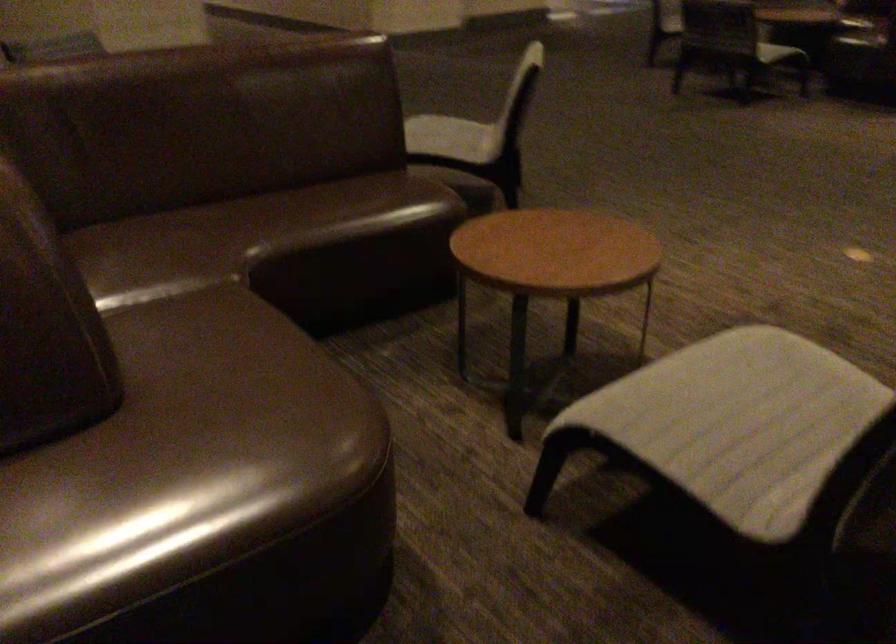
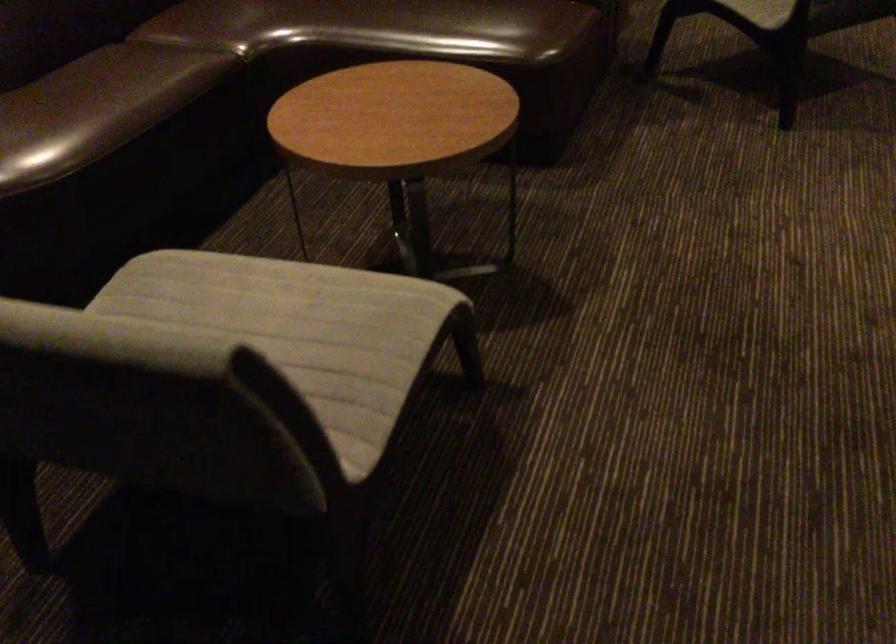
Locate, in the second image, the point that corresponds to pixel 325 398 in the first image.

(42, 138)